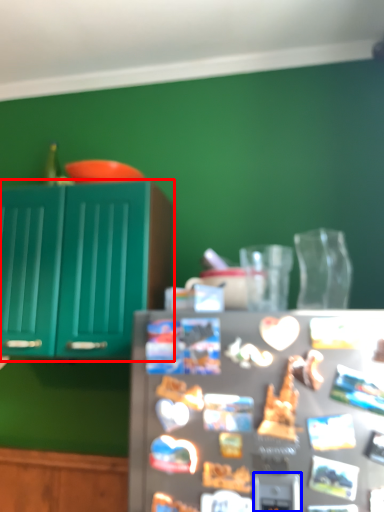
Question: Among these objects, which one is nearest to the camera, cabinetry (highlighted by a red box) or appliance (highlighted by a blue box)?

Choices:
 (A) cabinetry
 (B) appliance

Answer: (B)